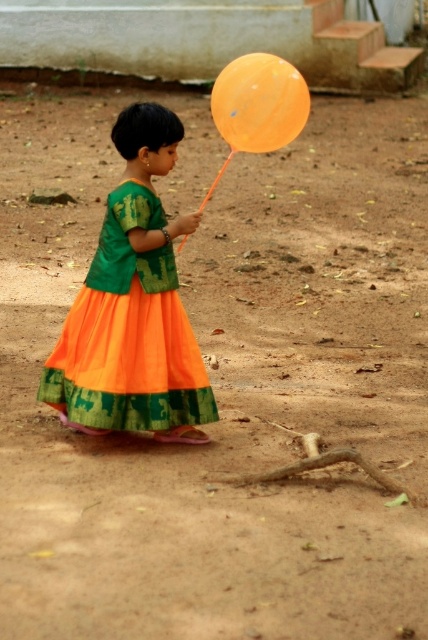
Is point (133, 292) farther from camera compared to point (262, 99)?

No, it is in front of (262, 99).

How far apart are orange chiffon dress at center and orange matte balloon at upper center?

The distance of orange chiffon dress at center from orange matte balloon at upper center is 5.16 feet.

Who is more distant from viewer, (187, 406) or (264, 132)?

The point (264, 132) is behind.

Where is `orange chiffon dress at center`? orange chiffon dress at center is located at coordinates [x=128, y=333].